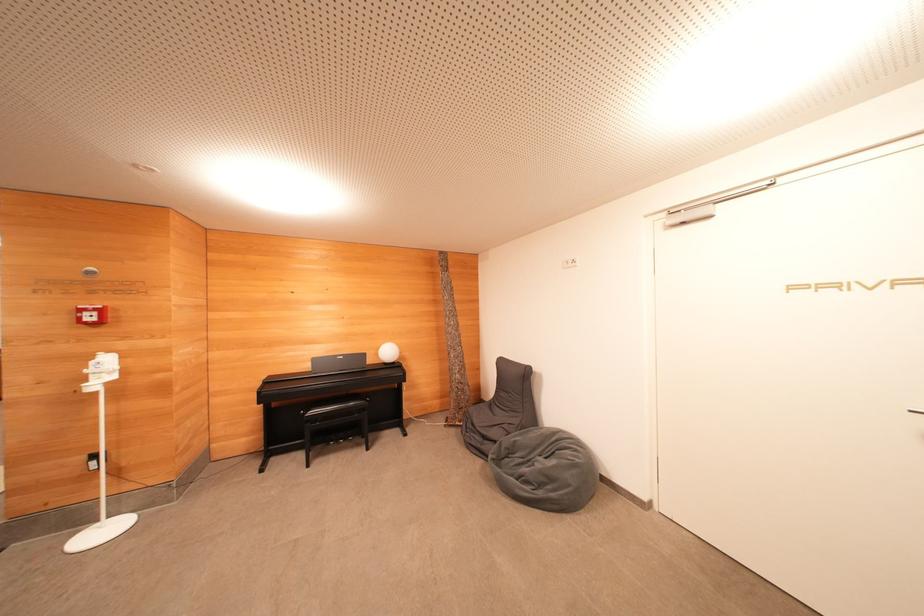
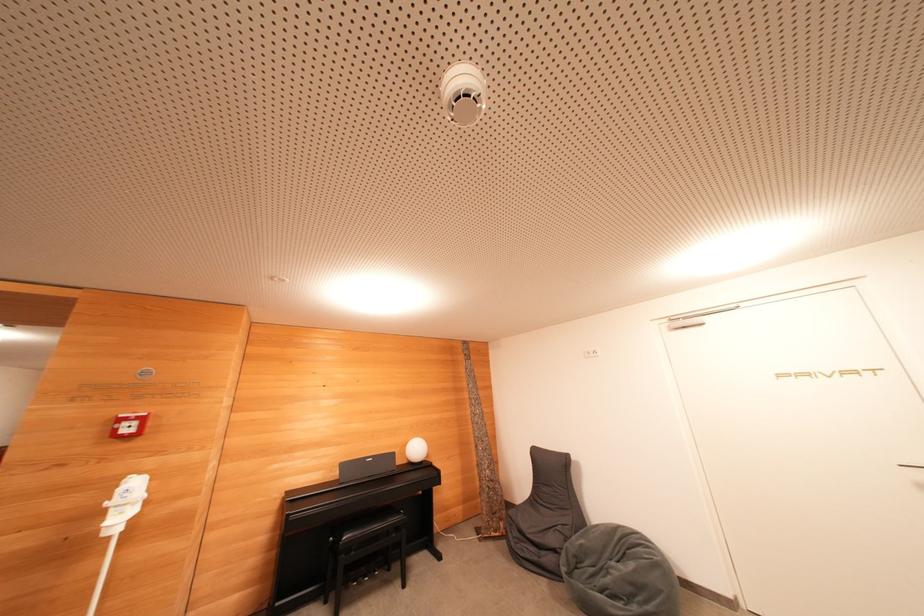
The point at (392, 355) is marked in the first image. Where is the corresponding point in the second image?

(419, 453)